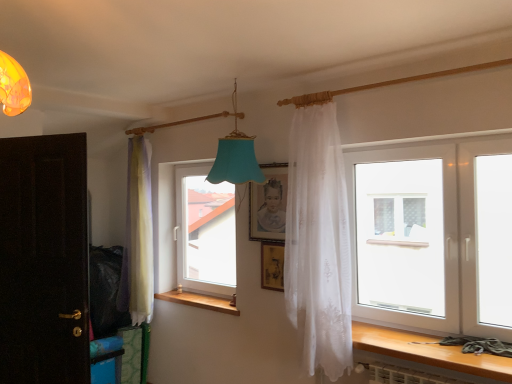
Question: Would you consider dark wood door at left to be distant from wooden at left?

Choices:
 (A) yes
 (B) no

Answer: (A)

Question: Can you confirm if dark wood door at left is bigger than wooden at left?

Choices:
 (A) no
 (B) yes

Answer: (B)

Question: Is dark wood door at left smaller than wooden at left?

Choices:
 (A) no
 (B) yes

Answer: (A)

Question: Considering the relative sizes of dark wood door at left and wooden at left in the image provided, is dark wood door at left shorter than wooden at left?

Choices:
 (A) no
 (B) yes

Answer: (A)

Question: Is dark wood door at left behind wooden at left?

Choices:
 (A) yes
 (B) no

Answer: (B)

Question: Based on their sizes in the image, would you say transparent plastic window at right, the 1th window positioned from the front, is bigger or smaller than matte wooden picture frame at center, the second picture frame positioned from the bottom?

Choices:
 (A) big
 (B) small

Answer: (A)

Question: Visually, is transparent plastic window at right, positioned as the second window in back-to-front order, positioned to the left or to the right of matte wooden picture frame at center, the 1th picture frame from the top?

Choices:
 (A) right
 (B) left

Answer: (A)

Question: Is point (351, 157) positioned closer to the camera than point (258, 210)?

Choices:
 (A) farther
 (B) closer

Answer: (B)

Question: From a real-world perspective, is transparent plastic window at right, placed as the second window when sorted from left to right, positioned above or below matte wooden picture frame at center, the second picture frame positioned from the bottom?

Choices:
 (A) above
 (B) below

Answer: (B)

Question: Considering their positions, is pastel sheer curtains at left, which is the first curtain in back-to-front order, located in front of or behind transparent glass window at center, which is counted as the second window, starting from the right?

Choices:
 (A) behind
 (B) front

Answer: (A)

Question: From the image's perspective, is pastel sheer curtains at left, the second curtain from the front, located above or below transparent glass window at center, which is the 1th window from left to right?

Choices:
 (A) above
 (B) below

Answer: (A)

Question: Is point (130, 261) closer or farther from the camera than point (220, 221)?

Choices:
 (A) farther
 (B) closer

Answer: (B)

Question: In terms of width, does pastel sheer curtains at left, the second curtain from the front, look wider or thinner when compared to transparent glass window at center, which is the 1th window in back-to-front order?

Choices:
 (A) wide
 (B) thin

Answer: (A)

Question: Considering the positions of dark wood door at left and wooden table at lower right in the image, is dark wood door at left wider or thinner than wooden table at lower right?

Choices:
 (A) thin
 (B) wide

Answer: (A)

Question: From a real-world perspective, relative to wooden table at lower right, is dark wood door at left vertically above or below?

Choices:
 (A) above
 (B) below

Answer: (A)